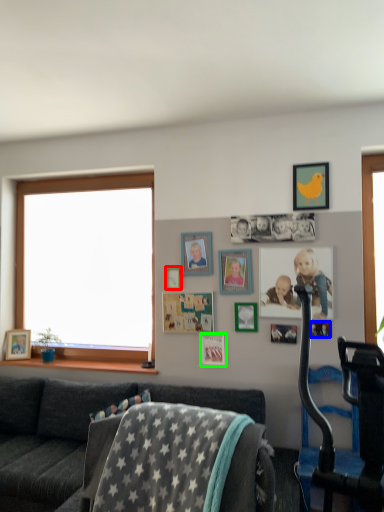
Question: Which object is the farthest from picture frame (highlighted by a red box)? Choose among these: picture frame (highlighted by a blue box) or picture frame (highlighted by a green box).

Choices:
 (A) picture frame
 (B) picture frame

Answer: (A)